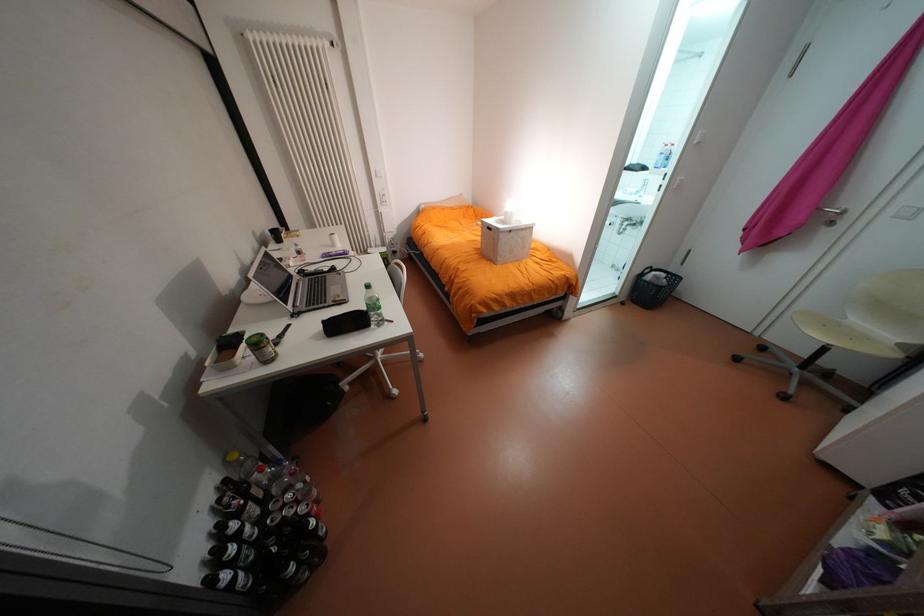
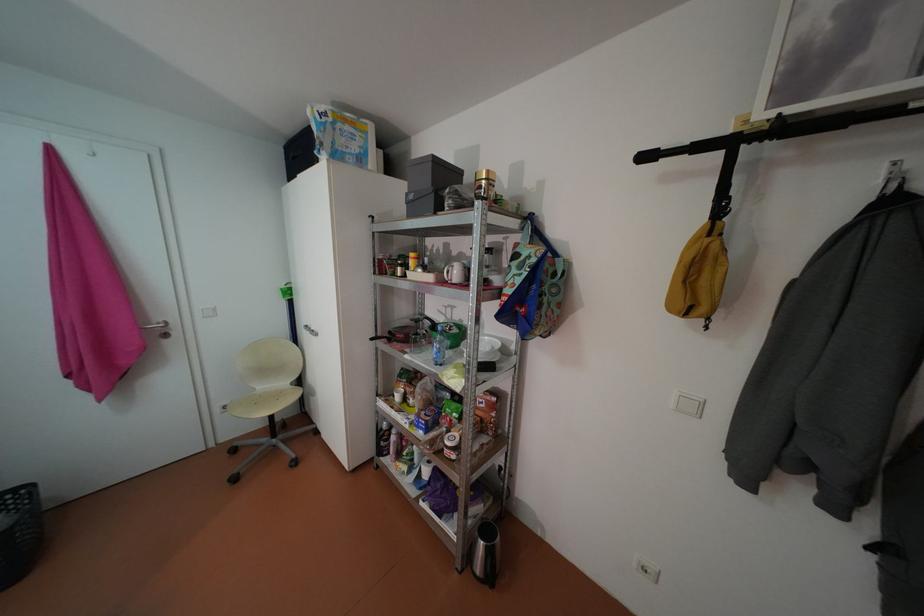
The first image is from the beginning of the video and the second image is from the end. How did the camera likely rotate when shooting the video?

The camera rotated toward right-down.